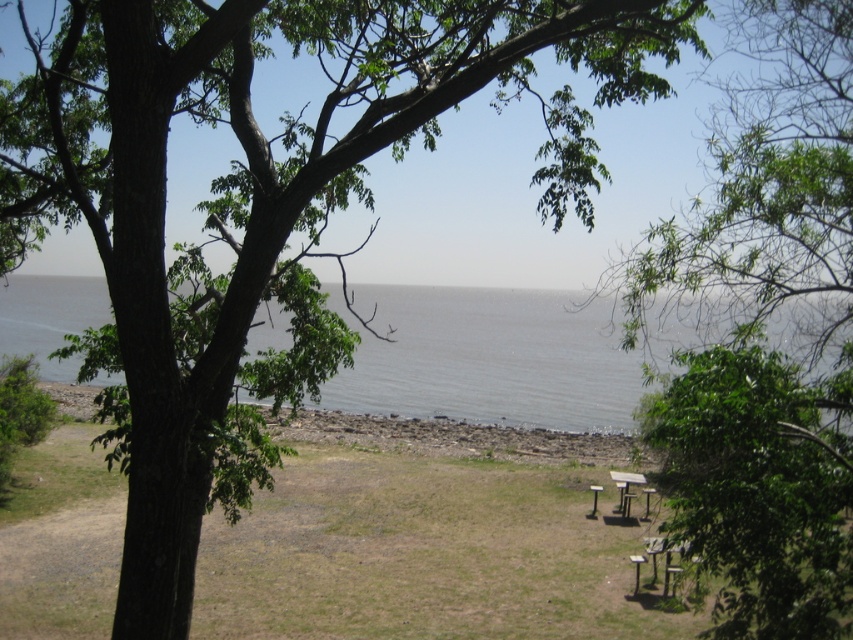
Is point (756, 547) less distant than point (497, 355)?

Yes, it is.

Is the position of green leafy tree at upper center more distant than that of gray water at center?

That is False.

Is point (776, 352) behind point (556, 344)?

No.

This screenshot has width=853, height=640. Identify the location of green leafy tree at upper center. (764, 333).

Between gray water at center and brown wooden table at lower right, which one is positioned higher?

gray water at center is above.

Is point (421, 308) more distant than point (618, 472)?

Yes, point (421, 308) is farther from viewer.

Where is `gray water at center`? This screenshot has height=640, width=853. gray water at center is located at coordinates (490, 358).

In the scene shown: Does green leafy tree at upper center have a larger size compared to brown wooden table at lower right?

Yes.

Between point (665, 252) and point (614, 474), which one is positioned behind?

The point (614, 474) is behind.

Who is more distant from viewer, (712,358) or (641,474)?

Point (641,474)

What are the coordinates of `green leafy tree at upper center` in the screenshot? It's located at (764, 333).